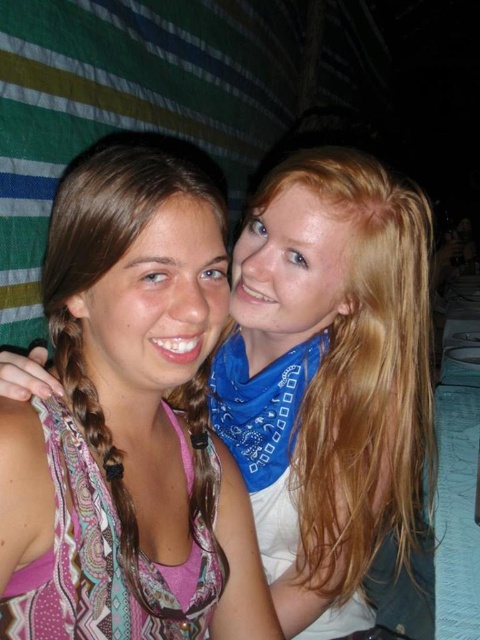
What do you see at coordinates (328, 380) in the screenshot?
I see `multicolored scarf at center` at bounding box center [328, 380].

Between point (416, 403) and point (205, 186), which one is positioned behind?

Positioned behind is point (416, 403).

Does point (248, 401) lie behind point (92, 250)?

Yes, point (248, 401) is farther from viewer.

I want to click on multicolored scarf at center, so tap(328, 380).